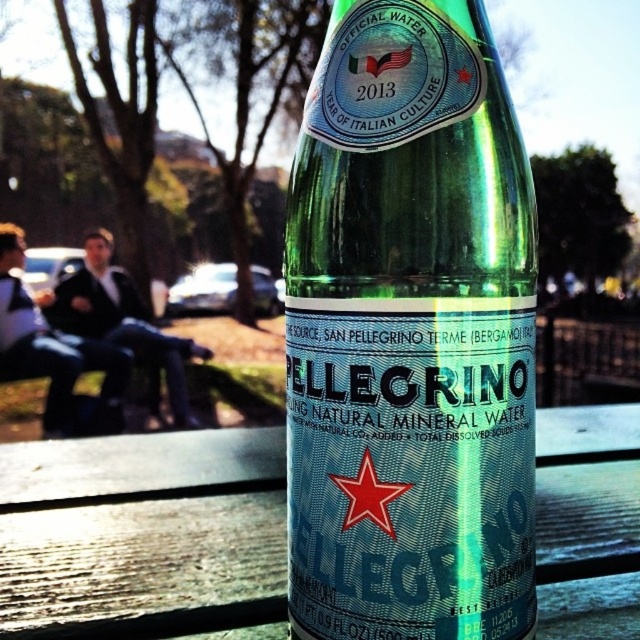
Which of these two, green glass bottle at center or wooden bench at center, stands taller?

green glass bottle at center is taller.

Can you confirm if green glass bottle at center is positioned to the right of wooden bench at center?

Yes, green glass bottle at center is to the right of wooden bench at center.

You are a GUI agent. You are given a task and a screenshot of the screen. Output one action in this format:
    pyautogui.click(x=<x>, y=<y>)
    Task: Click on the green glass bottle at center
    
    Given the screenshot: What is the action you would take?
    pyautogui.click(x=410, y=333)